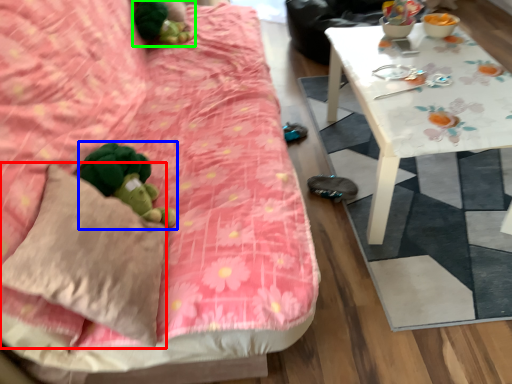
Question: Which object is positioned closest to throw pillow (highlighted by a red box)? Select from toy (highlighted by a blue box) and miniature (highlighted by a green box).

Choices:
 (A) toy
 (B) miniature

Answer: (A)